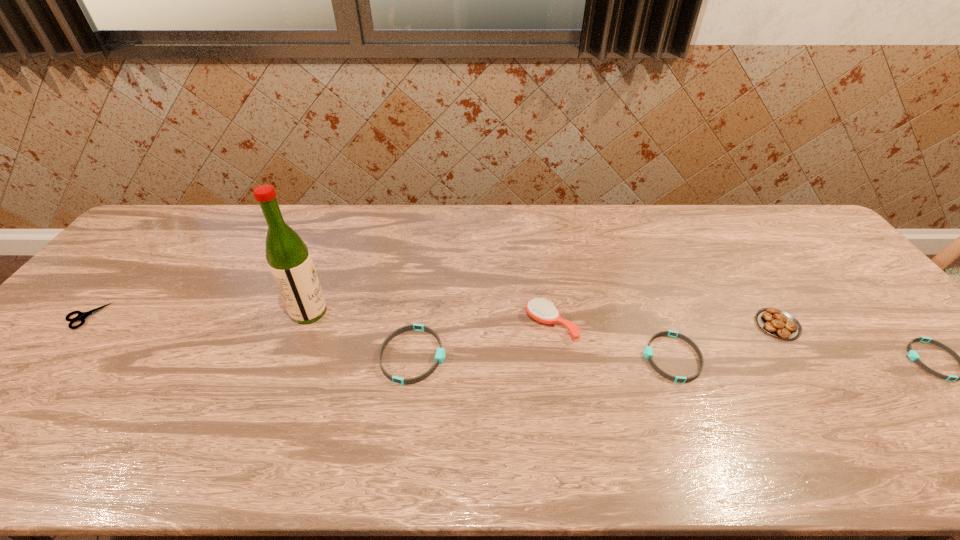
This screenshot has width=960, height=540. In order to click on the leftmost wristband in this screenshot , I will do `click(440, 354)`.

Find the location of a particular element. This screenshot has height=540, width=960. the second tallest wristband is located at coordinates (x=648, y=351).

In order to click on the fifth object from left to right in this screenshot , I will do `click(648, 351)`.

You are a GUI agent. You are given a task and a screenshot of the screen. Output one action in this format:
    pyautogui.click(x=<x>, y=<y>)
    Task: Click on the hairbrush
    This screenshot has height=540, width=960.
    Given the screenshot: What is the action you would take?
    pyautogui.click(x=543, y=311)

The width and height of the screenshot is (960, 540). Identify the location of the fourth object from right to left. (543, 311).

Identify the location of the shortest object. This screenshot has height=540, width=960. (81, 316).

Identify the location of shears. (81, 316).

At what (x,y) coordinates should I click in order to perform the action: click on the fifth shortest object. Please return your answer as a coordinate pair (x, y). This screenshot has height=540, width=960. Looking at the image, I should click on (776, 322).

Locate an element on the screen. This screenshot has height=540, width=960. the sixth object from left to right is located at coordinates (776, 322).

Image resolution: width=960 pixels, height=540 pixels. I want to click on the tallest object, so click(289, 260).